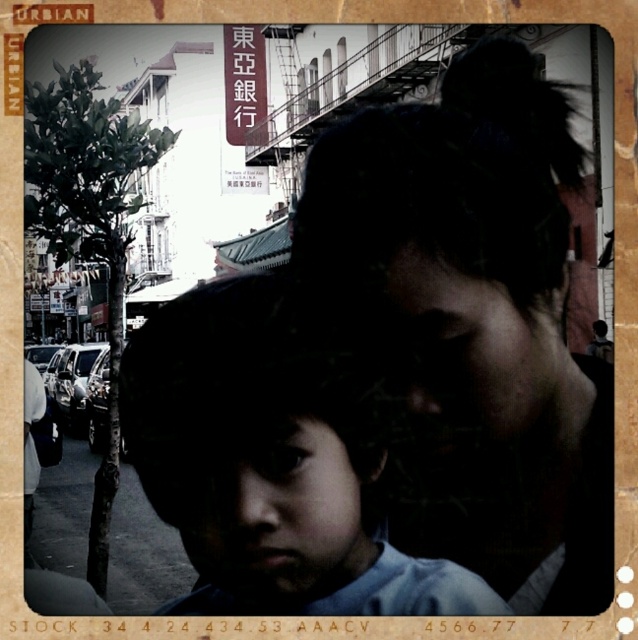
You are standing in front of a vintage photograph with a sepia tone. You notice two points marked on the image at coordinates point (486,547) and point (160,483). Based on the photo, which point is closer to you?

Point (486,547) is in front of point (160,483), so it is closer to you.

Looking at this image, you are an artist analyzing this vintage photo. You notice the matte black hair at center and the smooth skin child at center. Which object has a greater width in the image?

The matte black hair at center has a greater width than the smooth skin child at center.

You are a photographer analyzing a vintage photo. The photo has a border with the word URBIAN at the top left. You notice a point at coordinates [473,314]. Based on the scene description, what object or feature is located at this point?

The point at coordinates [473,314] is located on the matte black hair at center.